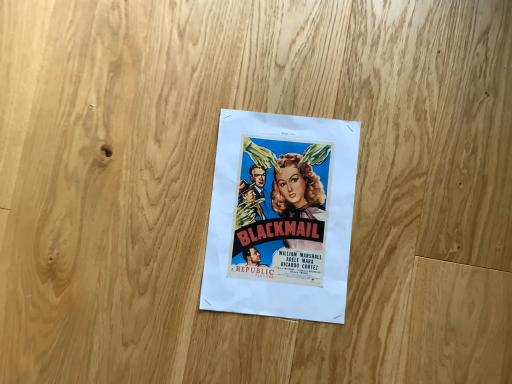
Find the location of `free spot above white paper poster at center (from a real-world perspective)`. free spot above white paper poster at center (from a real-world perspective) is located at coordinates (279, 212).